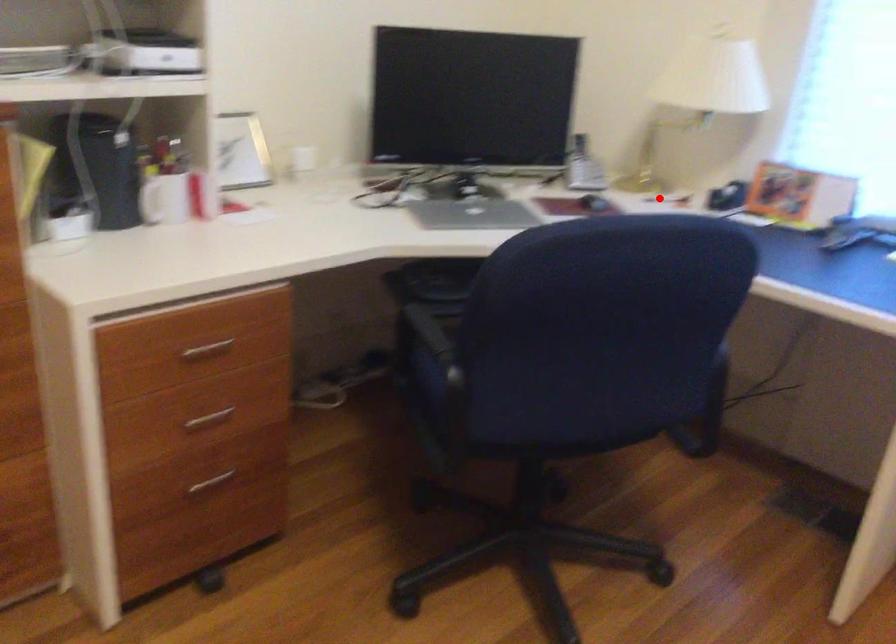
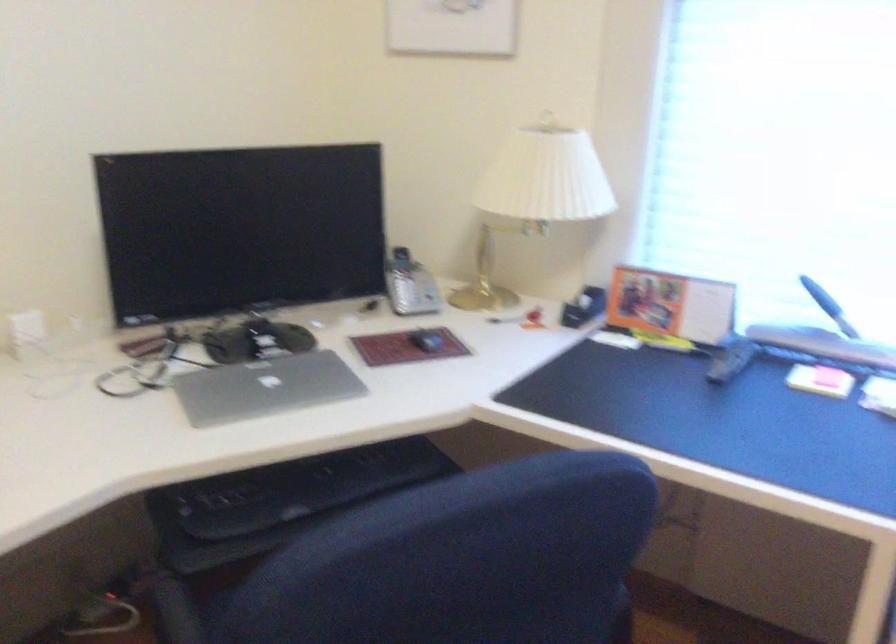
Question: I am providing you with two images of the same scene from different viewpoints. In image1, a red point is highlighted. Considering the same 3D point in image2, which of the following is correct?

Choices:
 (A) It is closer
 (B) It is farther

Answer: (A)